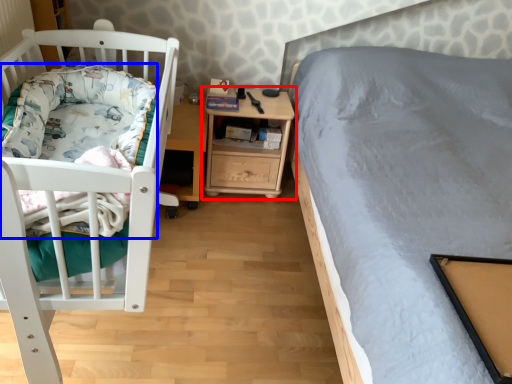
Question: Among these objects, which one is farthest to the camera, nightstand (highlighted by a red box) or blanket (highlighted by a blue box)?

Choices:
 (A) nightstand
 (B) blanket

Answer: (A)